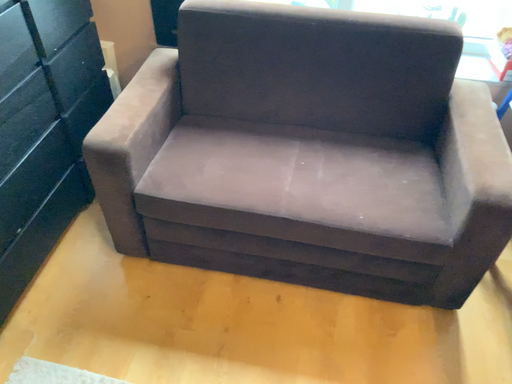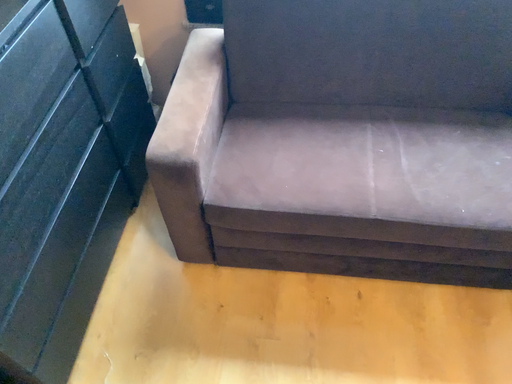
Question: Which way did the camera rotate in the video?

Choices:
 (A) rotated upward
 (B) rotated downward

Answer: (B)